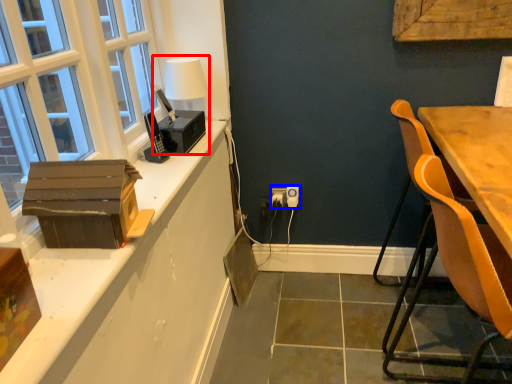
Question: Which point is further to the camera, table lamp (highlighted by a red box) or electric outlet (highlighted by a blue box)?

Choices:
 (A) table lamp
 (B) electric outlet

Answer: (B)